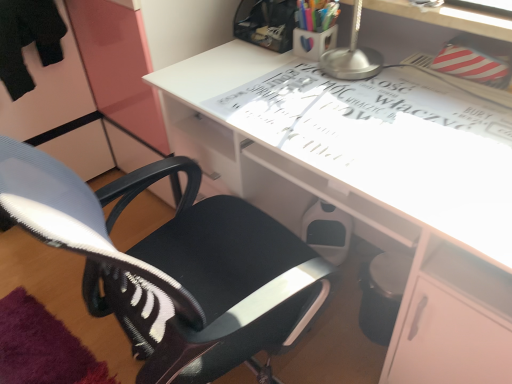
Question: Is white glossy desk at center far away from matte plastic cup at upper center, the first stationery in the bottom-to-top sequence?

Choices:
 (A) yes
 (B) no

Answer: (B)

Question: Considering the relative sizes of white glossy desk at center and matte plastic cup at upper center, the first stationery in the bottom-to-top sequence, in the image provided, is white glossy desk at center wider than matte plastic cup at upper center, the first stationery in the bottom-to-top sequence,?

Choices:
 (A) yes
 (B) no

Answer: (A)

Question: From a real-world perspective, is white glossy desk at center over matte plastic cup at upper center, which appears as the 2th stationery when viewed from the top?

Choices:
 (A) yes
 (B) no

Answer: (B)

Question: Is white glossy desk at center aimed at matte plastic cup at upper center, the first stationery in the bottom-to-top sequence?

Choices:
 (A) no
 (B) yes

Answer: (A)

Question: Considering the relative sizes of white glossy desk at center and matte plastic cup at upper center, the first stationery in the bottom-to-top sequence, in the image provided, is white glossy desk at center shorter than matte plastic cup at upper center, the first stationery in the bottom-to-top sequence,?

Choices:
 (A) no
 (B) yes

Answer: (A)

Question: From a real-world perspective, is white glossy desk at center below matte plastic cup at upper center, which appears as the 2th stationery when viewed from the top?

Choices:
 (A) no
 (B) yes

Answer: (B)

Question: Does matte plastic cup at upper center, the first stationery in the bottom-to-top sequence, have a greater height compared to white glossy desk at center?

Choices:
 (A) no
 (B) yes

Answer: (A)

Question: Considering the relative sizes of matte plastic cup at upper center, the first stationery in the bottom-to-top sequence, and white glossy desk at center in the image provided, is matte plastic cup at upper center, the first stationery in the bottom-to-top sequence, bigger than white glossy desk at center?

Choices:
 (A) no
 (B) yes

Answer: (A)

Question: Can you confirm if matte plastic cup at upper center, which appears as the 2th stationery when viewed from the top, is wider than white glossy desk at center?

Choices:
 (A) yes
 (B) no

Answer: (B)

Question: Is matte plastic cup at upper center, the first stationery in the bottom-to-top sequence, positioned far away from white glossy desk at center?

Choices:
 (A) no
 (B) yes

Answer: (A)

Question: Considering the relative positions of matte plastic cup at upper center, which appears as the 2th stationery when viewed from the top, and white glossy desk at center in the image provided, is matte plastic cup at upper center, which appears as the 2th stationery when viewed from the top, in front of white glossy desk at center?

Choices:
 (A) no
 (B) yes

Answer: (A)

Question: Is matte plastic cup at upper center, the first stationery in the bottom-to-top sequence, at the right side of white glossy desk at center?

Choices:
 (A) no
 (B) yes

Answer: (A)

Question: Is the depth of matte plastic cup at upper center, which appears as the 2th stationery when viewed from the top, greater than that of translucent plastic cup at upper center, marked as the 2th stationery in a bottom-to-top arrangement?

Choices:
 (A) no
 (B) yes

Answer: (B)